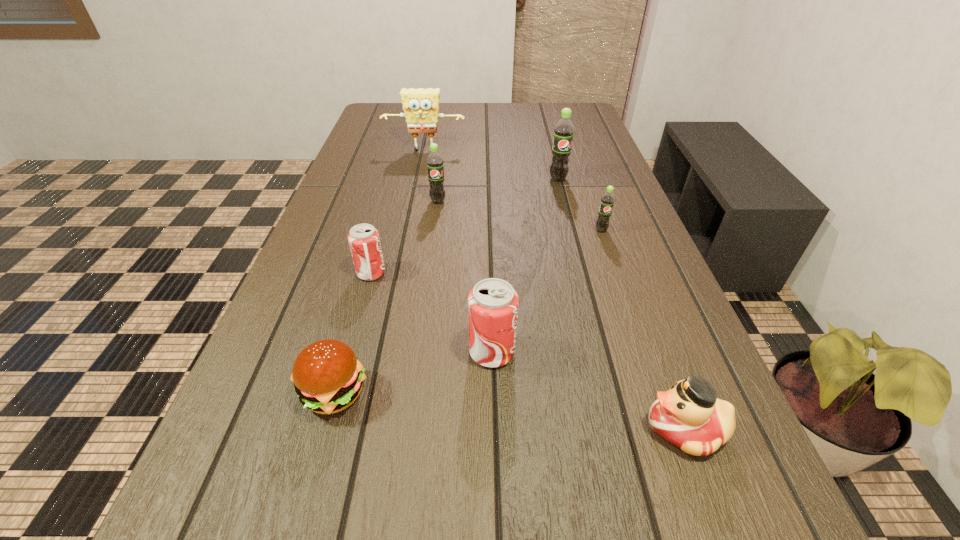
Identify the location of empty space between the second green soda from right to left and the brown hamburger. The width and height of the screenshot is (960, 540). (446, 286).

Locate an element on the screen. The image size is (960, 540). unoccupied area between the fourth soda from left to right and the hamburger is located at coordinates (446, 286).

At what (x,y) coordinates should I click in order to perform the action: click on vacant space that is in between the fifth object from left to right and the fourth soda from right to left. Please return your answer as a coordinate pair (x, y). The image size is (960, 540). Looking at the image, I should click on (465, 277).

Locate an element on the screen. The height and width of the screenshot is (540, 960). object that can be found as the third closest to the farther pink soda can is located at coordinates (435, 167).

Identify which object is the nearest to the third object from right to left. Please provide its 2D coordinates. Your answer should be formatted as a tuple, i.e. [(x, y)], where the tuple contains the x and y coordinates of a point satisfying the conditions above.

[(607, 201)]

Find the location of a particular element. soda that stands as the fourth closest to the hamburger is located at coordinates (607, 201).

This screenshot has height=540, width=960. I want to click on the fourth closest soda to the fourth soda from right to left, so click(x=493, y=303).

The width and height of the screenshot is (960, 540). In order to click on green soda that stands as the closest to the fifth nearest object in this screenshot , I will do `click(563, 131)`.

Where is `green soda that is the closest to the duck`? The width and height of the screenshot is (960, 540). green soda that is the closest to the duck is located at coordinates (607, 201).